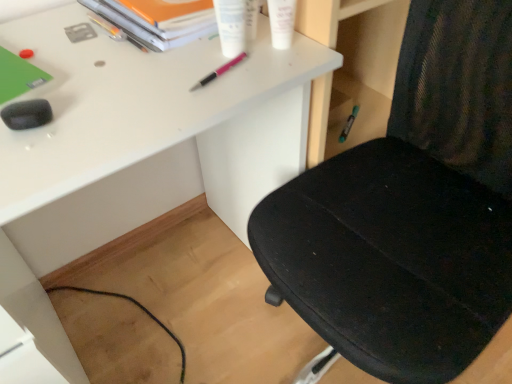
I want to click on vacant space to the right of white plastic tubes at upper center, the fourth stationery positioned from the back, so click(289, 51).